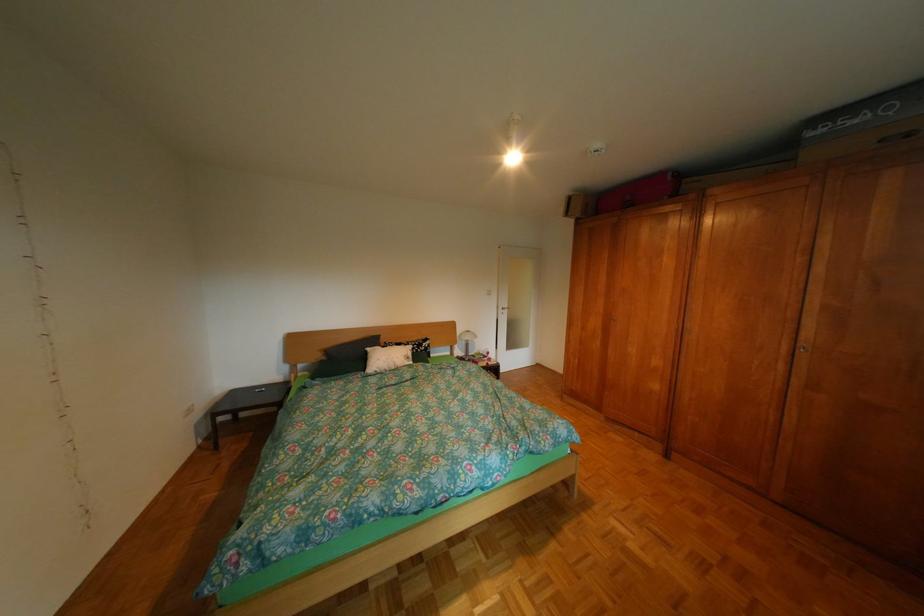
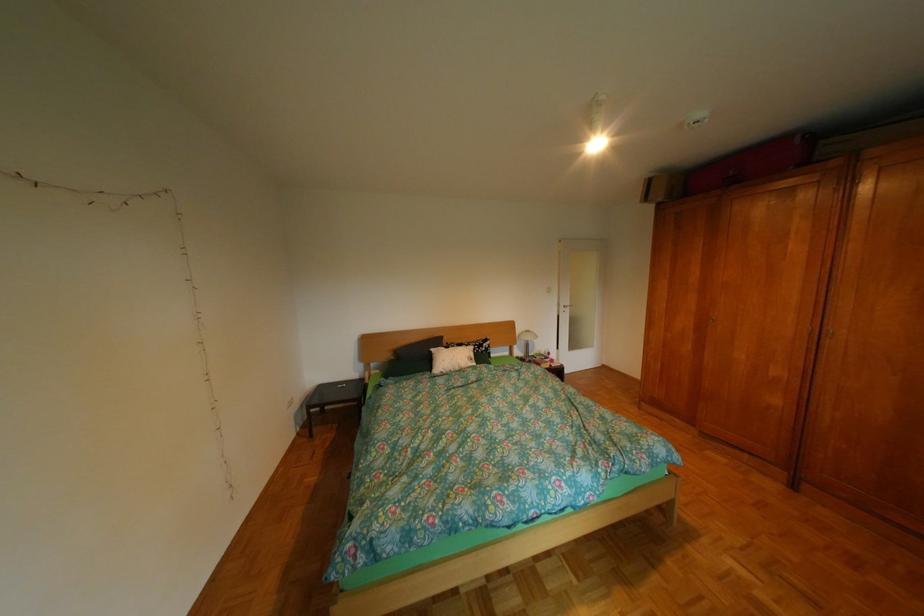
Find the pixel in the second image that matches point (685, 179) in the first image.

(812, 142)